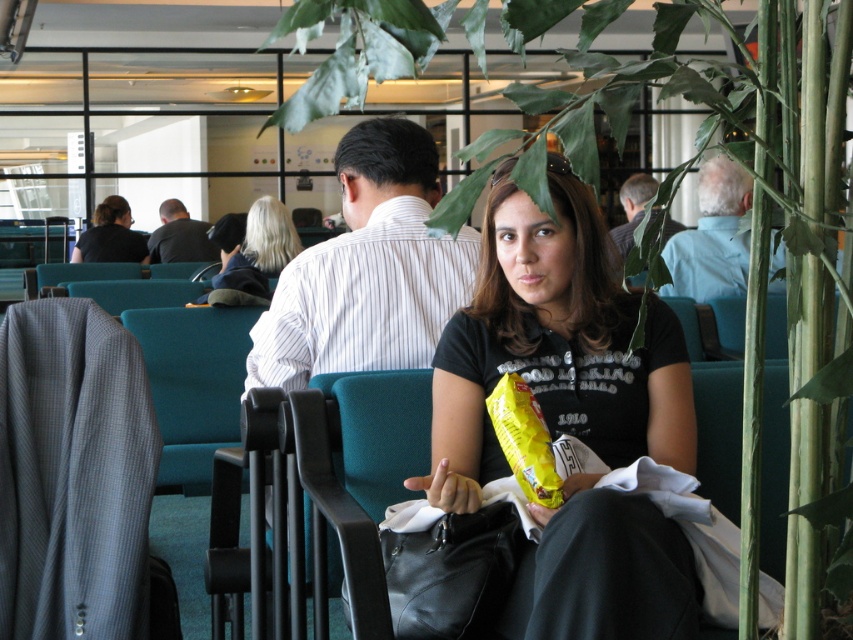
Question: Where is black leather bag at center located in relation to matte black shirt at center in the image?

Choices:
 (A) below
 (B) above

Answer: (A)

Question: Can you confirm if blue cotton shirt at upper right is positioned to the left of green fabric chair at center?

Choices:
 (A) yes
 (B) no

Answer: (B)

Question: Can you confirm if blue cotton shirt at upper right is positioned below blonde hair at center?

Choices:
 (A) yes
 (B) no

Answer: (B)

Question: Which object is positioned farthest from the black leather bag at center?

Choices:
 (A) black matte shirt at center
 (B) white striped shirt at center
 (C) gray checkered fabric at left

Answer: (B)

Question: Which of these objects is positioned closest to the gray checkered fabric at left?

Choices:
 (A) teal fabric chair at center
 (B) green leafy plant at center

Answer: (A)

Question: Which object appears farthest from the camera in this image?

Choices:
 (A) dark gray shirt at center
 (B) green fabric chair at center
 (C) gray checkered fabric at left

Answer: (A)